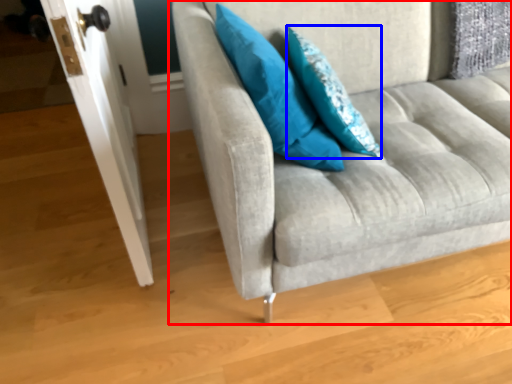
Question: Which object is further to the camera taking this photo, studio couch (highlighted by a red box) or pillow (highlighted by a blue box)?

Choices:
 (A) studio couch
 (B) pillow

Answer: (B)